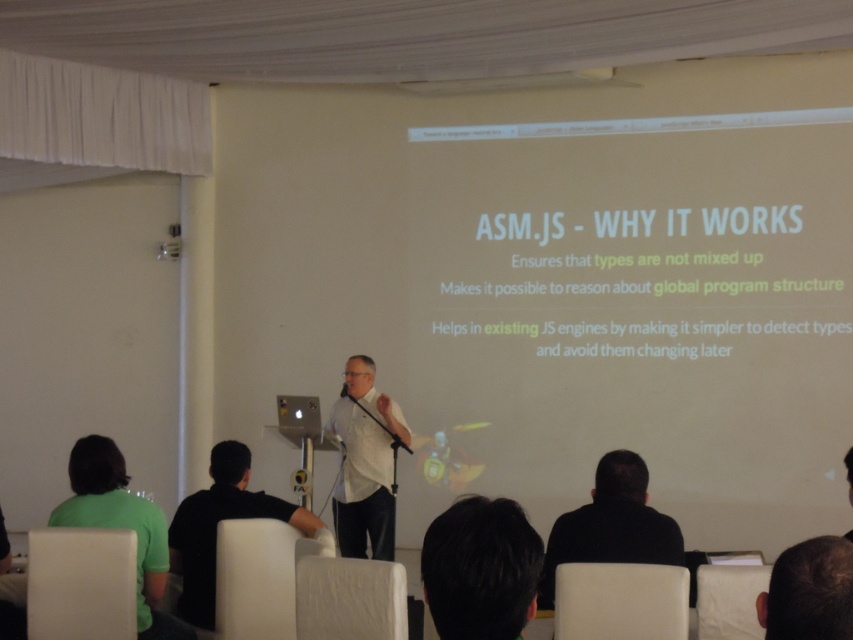
Question: Which object is the closest to the dark brown hair at lower right?

Choices:
 (A) white matte shirt at center
 (B) black shirt at lower center
 (C) metallic silver microphone at center
 (D) black hair at lower center

Answer: (D)

Question: Which point is farther from the camera taking this photo?

Choices:
 (A) (827, 616)
 (B) (618, 456)

Answer: (B)

Question: Is black hair at lower center smaller than black shirt at center?

Choices:
 (A) no
 (B) yes

Answer: (B)

Question: Does black shirt at center appear on the right side of dark brown hair at lower right?

Choices:
 (A) no
 (B) yes

Answer: (A)

Question: Does black hair at lower center have a lesser width compared to black shirt at lower center?

Choices:
 (A) yes
 (B) no

Answer: (A)

Question: Which of the following is the farthest from the observer?

Choices:
 (A) (519, 532)
 (B) (825, 611)

Answer: (A)